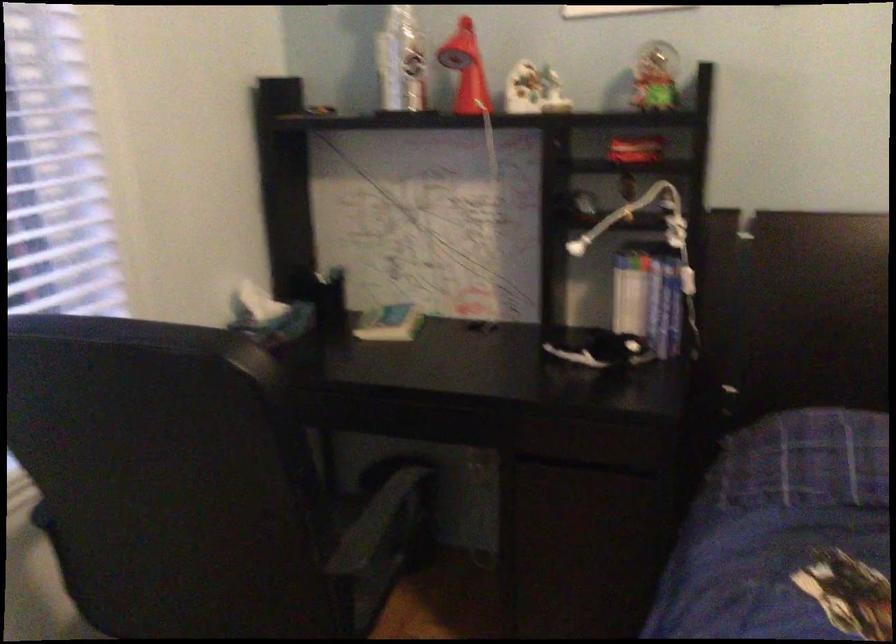
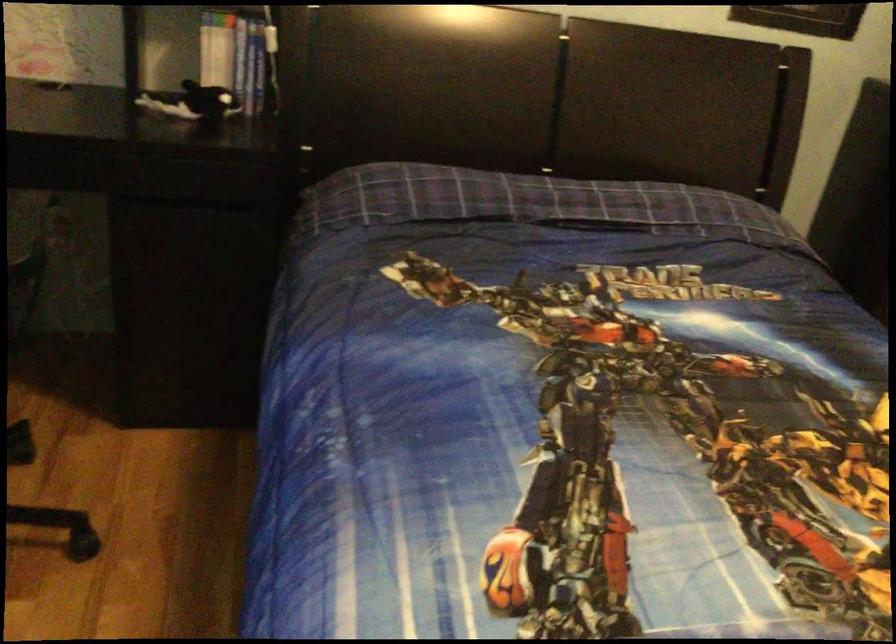
Question: The camera is either moving clockwise (left) or counter-clockwise (right) around the object. The first image is from the beginning of the video and the second image is from the end. Is the camera moving left or right when shooting the video?

Choices:
 (A) Left
 (B) Right

Answer: (A)